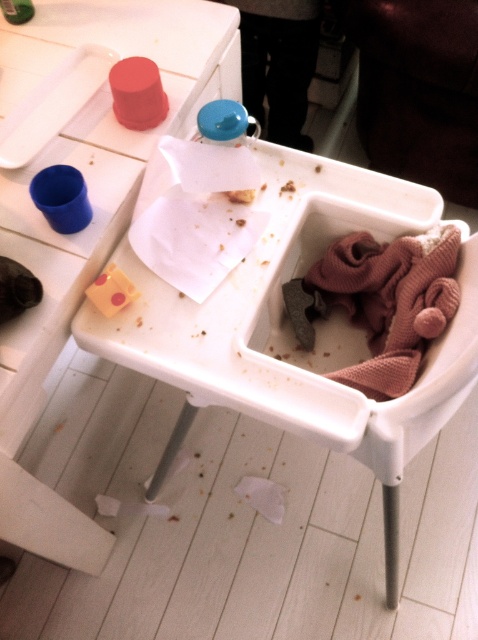
Based on the photo, you are a parent trying to clean up the high chair tray. You need to reach both the point at (x=366, y=214) and the point at (x=380, y=396). Which point should you clean first if you want to clean the one closer to you first?

You should clean point (x=380, y=396) first because it is closer to you than point (x=366, y=214), which is behind it.

You are a parent cleaning up after your child. You see the white plastic tray at upper left and the yellow cheese slice at upper center. Which item should you clean first if you want to start with the larger object?

You should clean the white plastic tray at upper left first because it is larger than the yellow cheese slice at upper center.